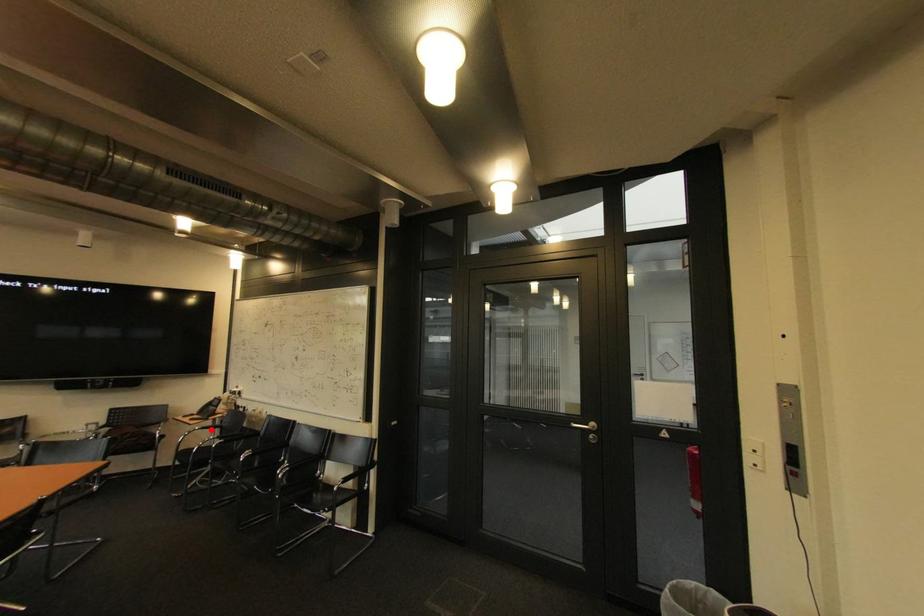
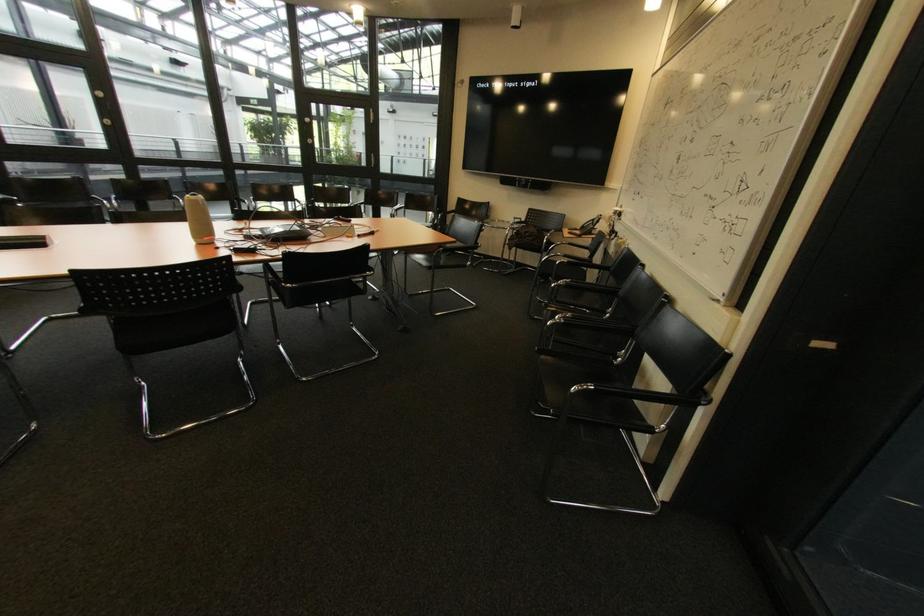
Locate, in the second image, the point that corresponds to the highlighted location in the first image.

(578, 245)